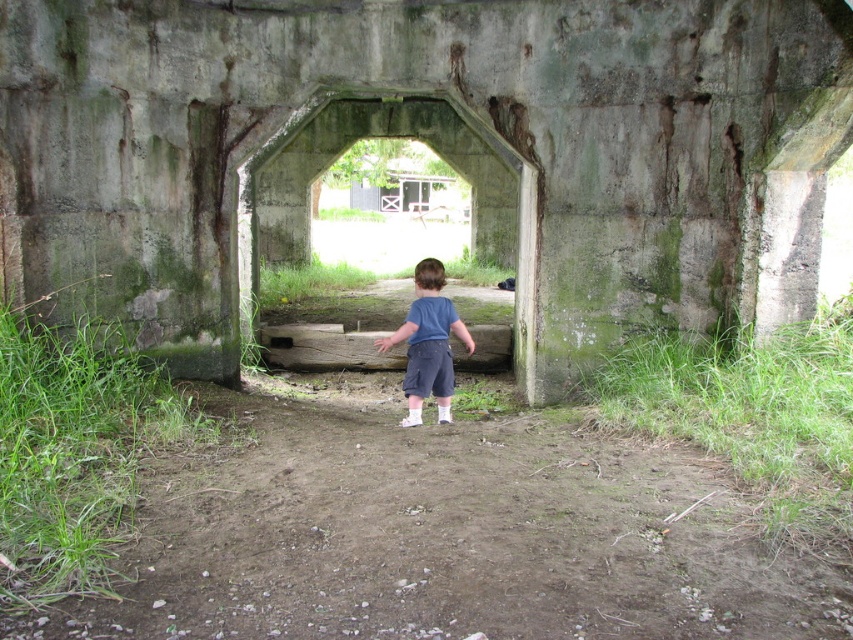
You are a GUI agent. You are given a task and a screenshot of the screen. Output one action in this format:
    pyautogui.click(x=<x>, y=<y>)
    Task: Click on the dirt ground at center
    This screenshot has height=640, width=853.
    Given the screenshot: What is the action you would take?
    pyautogui.click(x=442, y=531)

Does dirt ground at center appear on the right side of green concrete tunnel at center?

Yes, dirt ground at center is to the right of green concrete tunnel at center.

You are a GUI agent. You are given a task and a screenshot of the screen. Output one action in this format:
    pyautogui.click(x=<x>, y=<y>)
    Task: Click on the dirt ground at center
    The image size is (853, 640).
    Given the screenshot: What is the action you would take?
    pyautogui.click(x=442, y=531)

Does dirt ground at center have a lesser height compared to blue cotton shirt at center?

Yes, dirt ground at center is shorter than blue cotton shirt at center.

Who is shorter, dirt ground at center or blue cotton shirt at center?

dirt ground at center is shorter.

Where is `dirt ground at center`? This screenshot has height=640, width=853. dirt ground at center is located at coordinates (442, 531).

Does point (479, 186) come behind point (433, 353)?

Yes.

Who is taller, green concrete tunnel at center or blue cotton shirt at center?

Standing taller between the two is green concrete tunnel at center.

The image size is (853, 640). Describe the element at coordinates (384, 136) in the screenshot. I see `green concrete tunnel at center` at that location.

This screenshot has width=853, height=640. I want to click on green concrete tunnel at center, so (384, 136).